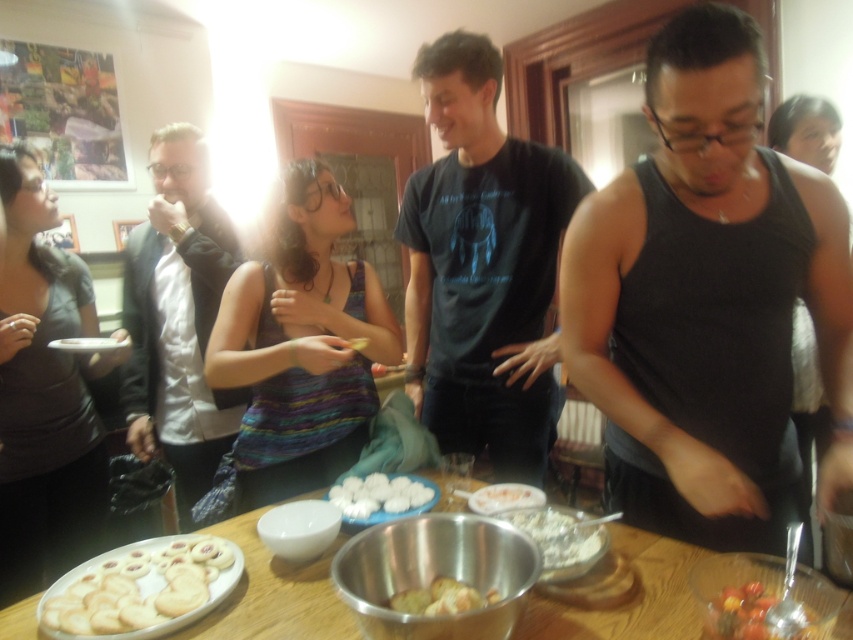
Question: Can you confirm if golden crispy cookies at lower left is smaller than white powdery flour at center?

Choices:
 (A) no
 (B) yes

Answer: (A)

Question: Which of these objects is positioned closest to the black cotton t-shirt at center?

Choices:
 (A) white powdery flour at center
 (B) white matte dumplings at center

Answer: (B)

Question: Can you confirm if black cotton t-shirt at center is wider than white powdery flour at center?

Choices:
 (A) no
 (B) yes

Answer: (B)

Question: Based on their relative distances, which object is nearer to the multicolored knitted sweater at center?

Choices:
 (A) black tank top at center
 (B) golden brown crumbly cookies at center
 (C) wooden table at center

Answer: (C)

Question: Among these objects, which one is nearest to the camera?

Choices:
 (A) black tank top at center
 (B) black cotton t-shirt at center

Answer: (A)

Question: Is multicolored knitted sweater at center to the right of wooden table at center from the viewer's perspective?

Choices:
 (A) no
 (B) yes

Answer: (A)